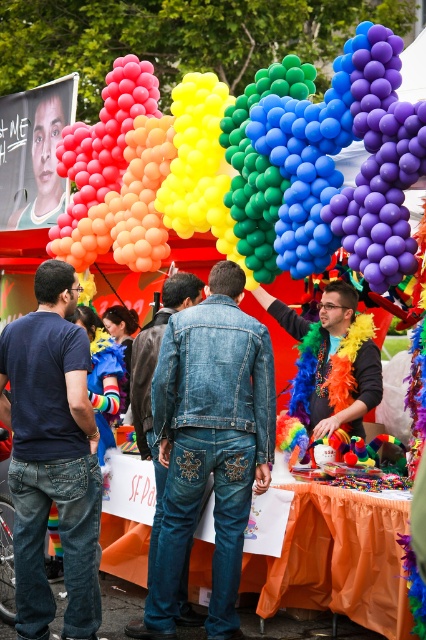
Question: Can you confirm if rainbow balloons at upper center is positioned below rainbow feather boa at center?

Choices:
 (A) yes
 (B) no

Answer: (B)

Question: Which object is positioned closest to the rainbow balloons at upper center?

Choices:
 (A) rainbow feather boa at center
 (B) faded denim jacket at center

Answer: (A)

Question: Which point is closer to the camera?

Choices:
 (A) faded denim jacket at center
 (B) rainbow feather boa at center

Answer: (A)

Question: Which object appears farthest from the camera in this image?

Choices:
 (A) denim jacket at center
 (B) rainbow feather boa at center
 (C) faded denim jacket at center
 (D) rainbow balloons at upper center

Answer: (B)

Question: Is rainbow balloons at upper center in front of rainbow feather boa at center?

Choices:
 (A) yes
 (B) no

Answer: (A)

Question: Does denim jacket at center appear on the right side of rainbow feather boa at center?

Choices:
 (A) yes
 (B) no

Answer: (B)